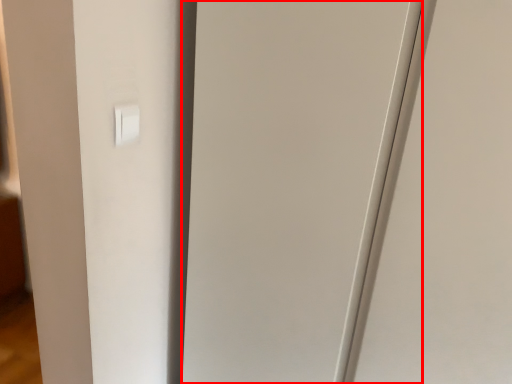
Question: From the image's perspective, what is the correct spatial relationship of glass door (annotated by the red box) in relation to light switch?

Choices:
 (A) above
 (B) below

Answer: (B)